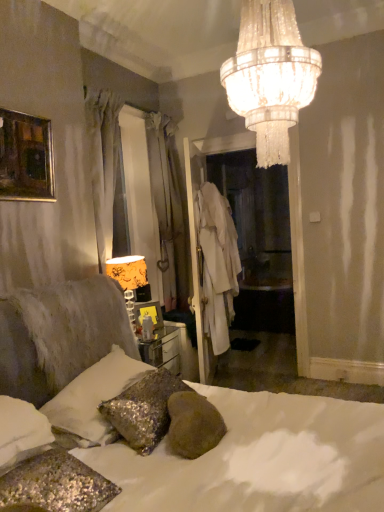
What do you see at coordinates (169, 210) in the screenshot?
I see `white sheer curtain at center` at bounding box center [169, 210].

Image resolution: width=384 pixels, height=512 pixels. What do you see at coordinates (56, 484) in the screenshot?
I see `shiny metallic pillow at lower left, the first pillow from the front` at bounding box center [56, 484].

What do you see at coordinates (217, 263) in the screenshot? This screenshot has width=384, height=512. I see `white cotton robe at center` at bounding box center [217, 263].

At what (x,y) coordinates should I click in order to perform the action: click on white sheer curtain at center. Please return your answer as a coordinate pair (x, y). The width and height of the screenshot is (384, 512). Looking at the image, I should click on (169, 210).

Is sparkly silver pillow at lower left, which is the 2th pillow from front to back, shorter than white fabric coat at center?

Yes, sparkly silver pillow at lower left, which is the 2th pillow from front to back, is shorter than white fabric coat at center.

From the image's perspective, is sparkly silver pillow at lower left, which is the 2th pillow from front to back, located above or below white fabric coat at center?

Based on their image positions, sparkly silver pillow at lower left, which is the 2th pillow from front to back, is located beneath white fabric coat at center.

Is point (78, 424) more distant than point (194, 255)?

No.

Looking at this image, from a real-world perspective, is sparkly silver pillow at lower left, which is the 2th pillow from front to back, below white fabric coat at center?

Yes, from a real-world perspective, sparkly silver pillow at lower left, which is the 2th pillow from front to back, is beneath white fabric coat at center.

I want to click on picture frame above the white sheer curtain at center (from the image's perspective), so click(26, 158).

Looking at this image, is gold-framed painting at upper left, positioned as the second picture frame in back-to-front order, thinner than white sheer curtain at center?

Yes.

Could you tell me if gold-framed painting at upper left, which ranks as the 2th picture frame in bottom-to-top order, is facing white sheer curtain at center?

No, gold-framed painting at upper left, which ranks as the 2th picture frame in bottom-to-top order, is not oriented towards white sheer curtain at center.

Is gold-framed painting at upper left, the first picture frame in the left-to-right sequence, positioned far away from white sheer curtain at center?

gold-framed painting at upper left, the first picture frame in the left-to-right sequence, is positioned a significant distance from white sheer curtain at center.

Locate an element on the screen. This screenshot has height=512, width=384. robe located behind the metallic silver picture frame at center, the first picture frame from the right is located at coordinates pos(217,263).

Considering the sizes of objects metallic silver picture frame at center, which is the first picture frame from bottom to top, and white cotton robe at center in the image provided, who is thinner, metallic silver picture frame at center, which is the first picture frame from bottom to top, or white cotton robe at center?

metallic silver picture frame at center, which is the first picture frame from bottom to top.

Consider the image. From the image's perspective, who appears lower, metallic silver picture frame at center, acting as the second picture frame starting from the top, or white cotton robe at center?

From the image's view, metallic silver picture frame at center, acting as the second picture frame starting from the top, is below.

Does orange fabric lampshade at left have a greater height compared to gold-framed painting at upper left, arranged as the 1th picture frame when viewed from the front?

Correct, orange fabric lampshade at left is much taller as gold-framed painting at upper left, arranged as the 1th picture frame when viewed from the front.

At what (x,y) coordinates should I click in order to perform the action: click on picture frame on the left of orange fabric lampshade at left. Please return your answer as a coordinate pair (x, y). Image resolution: width=384 pixels, height=512 pixels. Looking at the image, I should click on (26, 158).

Can you tell me how much orange fabric lampshade at left and gold-framed painting at upper left, which ranks as the 2th picture frame in bottom-to-top order, differ in facing direction?

There is a 0.604-degree angle between the facing directions of orange fabric lampshade at left and gold-framed painting at upper left, which ranks as the 2th picture frame in bottom-to-top order.

Could you tell me if orange fabric lampshade at left is turned towards gold-framed painting at upper left, arranged as the 1th picture frame when viewed from the front?

No, orange fabric lampshade at left is not aimed at gold-framed painting at upper left, arranged as the 1th picture frame when viewed from the front.

Does white sequined pillow at lower left, which is the 1th pillow in back-to-front order, turn towards shiny metallic pillow at lower left, the 3th pillow viewed from the back?

No, white sequined pillow at lower left, which is the 1th pillow in back-to-front order, is not aimed at shiny metallic pillow at lower left, the 3th pillow viewed from the back.

From the image's perspective, which one is positioned higher, white sequined pillow at lower left, which ranks as the 3th pillow in front-to-back order, or shiny metallic pillow at lower left, the 3th pillow viewed from the back?

white sequined pillow at lower left, which ranks as the 3th pillow in front-to-back order, appears higher in the image.

Is white sequined pillow at lower left, which ranks as the 3th pillow in front-to-back order, positioned far away from shiny metallic pillow at lower left, the 3th pillow viewed from the back?

That's not correct — white sequined pillow at lower left, which ranks as the 3th pillow in front-to-back order, is a little close to shiny metallic pillow at lower left, the 3th pillow viewed from the back.

Looking at their sizes, would you say white sequined pillow at lower left, which is the 1th pillow in back-to-front order, is wider or thinner than shiny metallic pillow at lower left, the first pillow from the front?

white sequined pillow at lower left, which is the 1th pillow in back-to-front order, is wider than shiny metallic pillow at lower left, the first pillow from the front.

Is white cotton robe at center aimed at white sequined pillow at lower left, which is the 1th pillow in back-to-front order?

No, white cotton robe at center is not oriented towards white sequined pillow at lower left, which is the 1th pillow in back-to-front order.

Which is less distant, (217, 308) or (110, 346)?

Point (110, 346)

Based on the photo, from a real-world perspective, between white cotton robe at center and white sequined pillow at lower left, which is the 1th pillow in back-to-front order, who is vertically lower?

white sequined pillow at lower left, which is the 1th pillow in back-to-front order, from a real-world perspective.

Does crystal chandelier at upper center touch white sequined pillow at lower left?

There is a gap between crystal chandelier at upper center and white sequined pillow at lower left.

Could you tell me if crystal chandelier at upper center is turned towards white sequined pillow at lower left?

No, crystal chandelier at upper center is not oriented towards white sequined pillow at lower left.

Where is `glass door on the right of sparkly silver pillow at lower left, which is the 2th pillow from front to back`? The height and width of the screenshot is (512, 384). glass door on the right of sparkly silver pillow at lower left, which is the 2th pillow from front to back is located at coordinates (195, 270).

This screenshot has width=384, height=512. I want to click on picture frame above the white sheer curtain at center (from a real-world perspective), so click(26, 158).

Looking at this image, from the image, which object appears to be farther from white sequined pillow at lower left, white fabric coat at center or white sheer curtain at center?

white sheer curtain at center is positioned further to the anchor white sequined pillow at lower left.

When comparing their distances from shiny metallic pillow at lower left, the 3th pillow viewed from the back, does white sheer curtain at center or white sequined pillow at lower left seem further?

Based on the image, white sheer curtain at center appears to be further to shiny metallic pillow at lower left, the 3th pillow viewed from the back.

Which object lies further to the anchor point crystal chandelier at upper center, sparkly silver pillow at lower left, which is the 2th pillow from front to back, or white sheer curtain at center?

white sheer curtain at center.

Considering their positions, is metallic silver picture frame at center, the first picture frame from the right, positioned closer to crystal chandelier at upper center than white sequined pillow at lower left?

The object closer to crystal chandelier at upper center is white sequined pillow at lower left.

Estimate the real-world distances between objects in this image. Which object is closer to metallic silver picture frame at center, the first picture frame from the right, white sequined pillow at lower left or white sequined pillow at lower left, which is the 1th pillow in back-to-front order?

Among the two, white sequined pillow at lower left, which is the 1th pillow in back-to-front order, is located nearer to metallic silver picture frame at center, the first picture frame from the right.

When comparing their distances from white sequined pillow at lower left, does orange fabric lampshade at left or sparkly silver pillow at lower left, the second pillow positioned from the back, seem closer?

sparkly silver pillow at lower left, the second pillow positioned from the back, is closer to white sequined pillow at lower left.

Looking at the image, which one is located closer to white cotton robe at center, white sheer curtain at center or metallic silver picture frame at center, which is the first picture frame from bottom to top?

white sheer curtain at center.

Looking at the image, which one is located further to white fabric coat at center, sparkly silver pillow at lower left, the second pillow positioned from the back, or crystal chandelier at upper center?

crystal chandelier at upper center is positioned further to the anchor white fabric coat at center.

Locate an element on the screen. picture frame between sparkly silver pillow at lower left, the second pillow positioned from the back, and metallic silver picture frame at center, which is the 2th picture frame from front to back, in the front-back direction is located at coordinates (26, 158).

Find the location of `robe located between sparkly silver pillow at lower left, which is the 2th pillow from front to back, and white sheer curtain at center in the depth direction`. robe located between sparkly silver pillow at lower left, which is the 2th pillow from front to back, and white sheer curtain at center in the depth direction is located at coordinates (217, 263).

This screenshot has width=384, height=512. Find the location of `pillow positioned between shiny metallic pillow at lower left, the 3th pillow viewed from the back, and white sequined pillow at lower left, which ranks as the 3th pillow in front-to-back order, from near to far`. pillow positioned between shiny metallic pillow at lower left, the 3th pillow viewed from the back, and white sequined pillow at lower left, which ranks as the 3th pillow in front-to-back order, from near to far is located at coordinates (94, 397).

I want to click on light fixture between white sequined pillow at lower left and metallic silver picture frame at center, acting as the second picture frame starting from the top, in the front-back direction, so click(x=128, y=278).